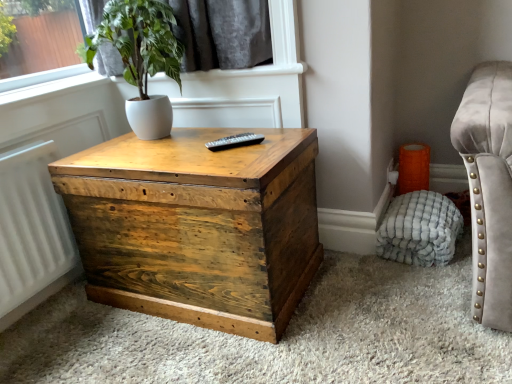
Question: Is point (300, 233) closer or farther from the camera than point (458, 235)?

Choices:
 (A) farther
 (B) closer

Answer: (B)

Question: Considering the positions of wooden trunk at center and white textured pouf at lower right in the image, is wooden trunk at center wider or thinner than white textured pouf at lower right?

Choices:
 (A) thin
 (B) wide

Answer: (B)

Question: Estimate the real-world distances between objects in this image. Which object is farther from the wooden trunk at center?

Choices:
 (A) white matte pot at upper left
 (B) black plastic remote at center
 (C) white textured pouf at lower right

Answer: (C)

Question: Which of these objects is positioned farthest from the wooden trunk at center?

Choices:
 (A) black plastic remote at center
 (B) white matte pot at upper left
 (C) white textured pouf at lower right

Answer: (C)